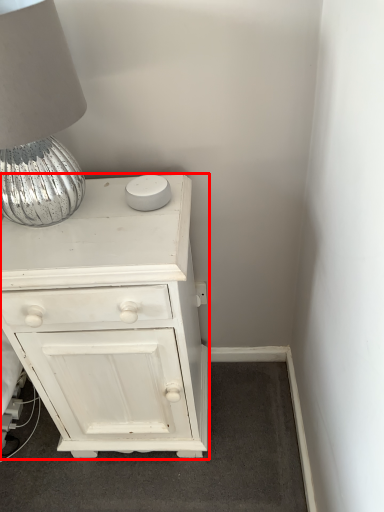
Question: From the image's perspective, what is the correct spatial relationship of chest of drawers (annotated by the red box) in relation to table lamp?

Choices:
 (A) above
 (B) below

Answer: (B)